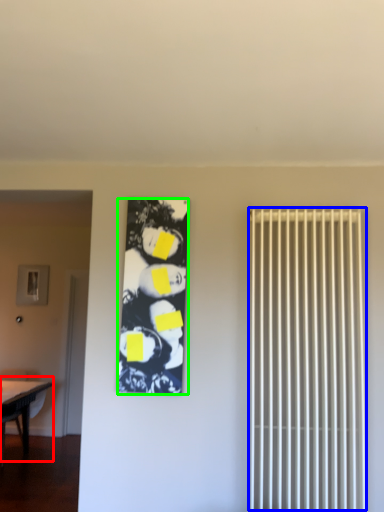
Question: Based on their relative distances, which object is farther from table (highlighted by a red box)? Choose from radiator (highlighted by a blue box) and couple (highlighted by a green box).

Choices:
 (A) radiator
 (B) couple

Answer: (A)